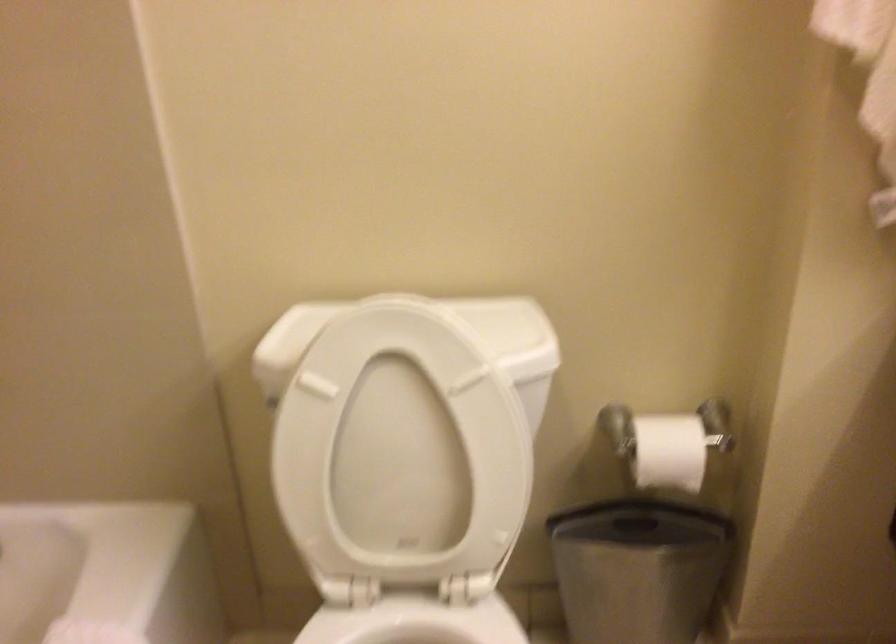
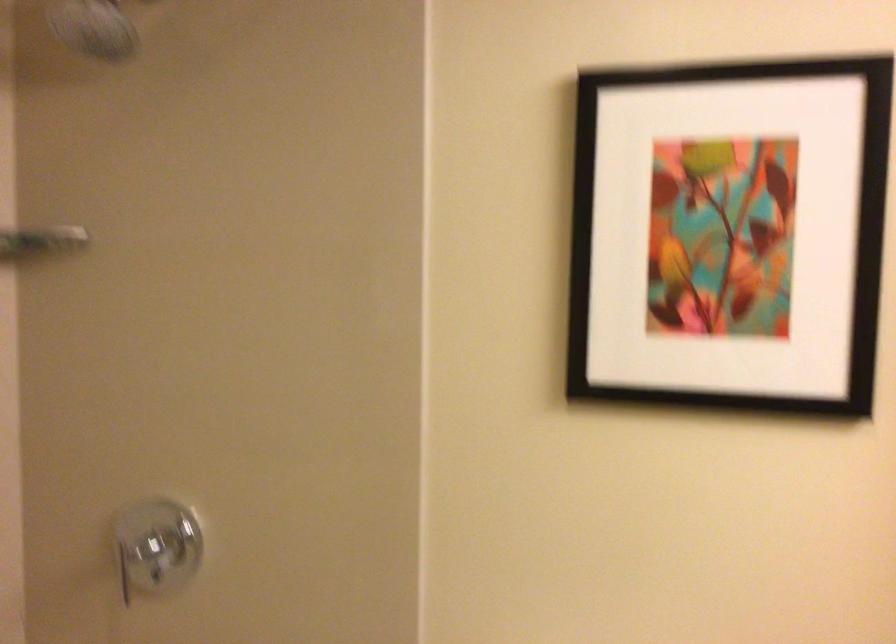
How did the camera likely rotate?

The camera rotated toward left-up.